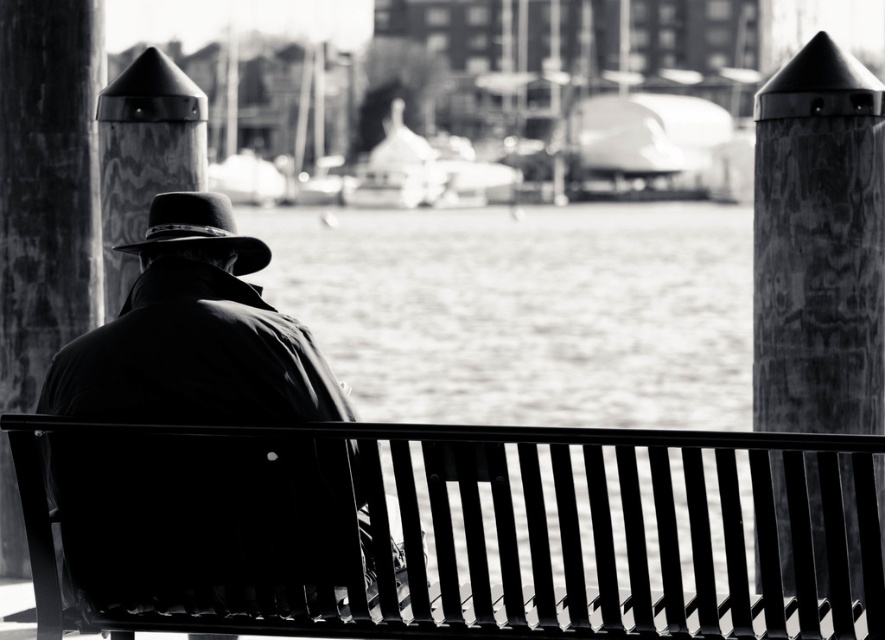
Is smooth wood post at center left positioned behind felt fedora at center?

Yes, smooth wood post at center left is further from the viewer.

Does smooth wood post at center left have a larger size compared to felt fedora at center?

Indeed, smooth wood post at center left has a larger size compared to felt fedora at center.

Image resolution: width=885 pixels, height=640 pixels. Identify the location of smooth wood post at center left. (144, 156).

Is metallic black bench at center taller than felt fedora at center?

Yes, metallic black bench at center is taller than felt fedora at center.

Looking at this image, is the position of metallic black bench at center less distant than that of felt fedora at center?

Yes, it is.

Who is more distant from viewer, (635, 632) or (187, 209)?

The point (187, 209) is behind.

Where is `metallic black bench at center`? The image size is (885, 640). metallic black bench at center is located at coordinates (442, 529).

Is point (763, 588) less distant than point (178, 88)?

Yes, point (763, 588) is closer to viewer.

Between point (319, 560) and point (143, 96), which one is positioned in front?

Point (319, 560)

The height and width of the screenshot is (640, 885). Identify the location of metallic black bench at center. (442, 529).